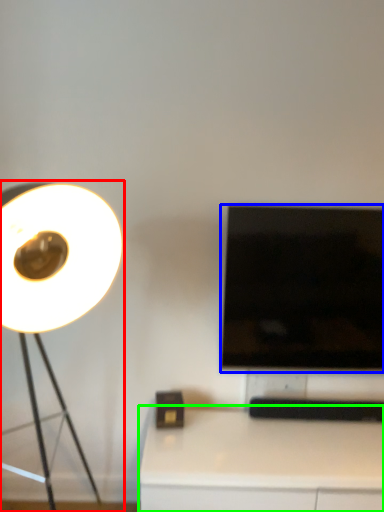
Question: Which object is the closest to the lamp (highlighted by a red box)? Choose among these: television (highlighted by a blue box) or table (highlighted by a green box).

Choices:
 (A) television
 (B) table

Answer: (A)